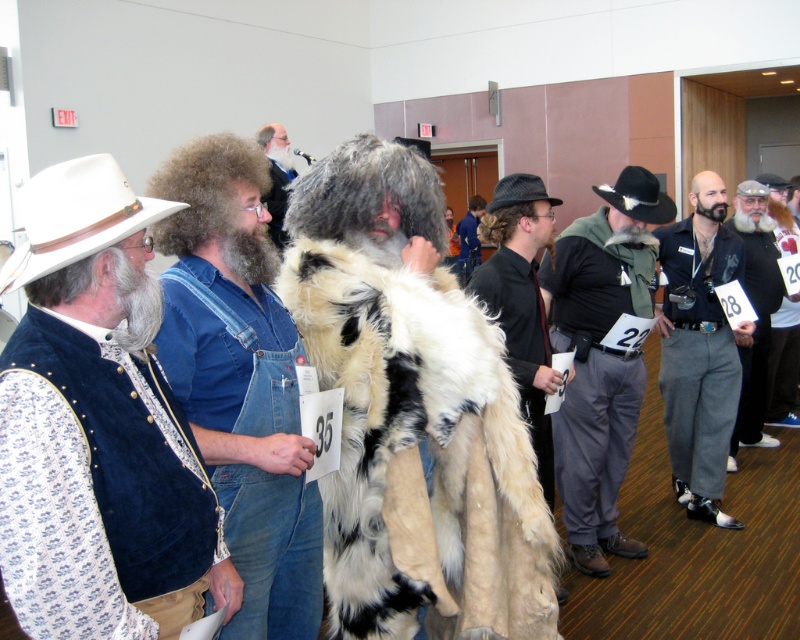
Question: Which of the following is the farthest from the observer?

Choices:
 (A) fluffy fur coat at center
 (B) blue denim overalls at center
 (C) gray wool pants at center
 (D) velvet vest at left

Answer: (A)

Question: Is gray woolen coat at center wider than beige wool coat at right?

Choices:
 (A) yes
 (B) no

Answer: (A)

Question: Which object is the farthest from the gray wool pants at center?

Choices:
 (A) gray felt cowboy hat at upper right
 (B) gray woolen coat at right

Answer: (A)

Question: Can you confirm if blue denim overalls at center is bigger than white leather cowboy hat at left?

Choices:
 (A) yes
 (B) no

Answer: (A)

Question: Which point is farther from the camera taking this photo?

Choices:
 (A) (288, 493)
 (B) (272, 125)
 (C) (621, 179)

Answer: (B)

Question: Is white fur coat at center to the left of gray wool pants at center from the viewer's perspective?

Choices:
 (A) yes
 (B) no

Answer: (A)